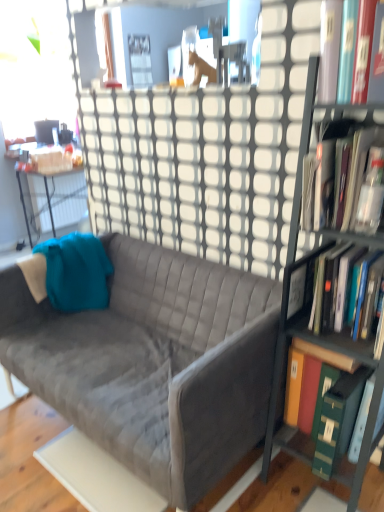
Question: Considering the relative positions of green hardcover book at right, which ranks as the first book in bottom-to-top order, and velvet gray couch at center in the image provided, is green hardcover book at right, which ranks as the first book in bottom-to-top order, behind velvet gray couch at center?

Choices:
 (A) no
 (B) yes

Answer: (B)

Question: Is green hardcover book at right, marked as the 4th book in a top-to-bottom arrangement, to the left of velvet gray couch at center from the viewer's perspective?

Choices:
 (A) no
 (B) yes

Answer: (A)

Question: From a real-world perspective, is green hardcover book at right, marked as the 4th book in a top-to-bottom arrangement, beneath velvet gray couch at center?

Choices:
 (A) no
 (B) yes

Answer: (A)

Question: Does green hardcover book at right, which ranks as the first book in bottom-to-top order, touch velvet gray couch at center?

Choices:
 (A) no
 (B) yes

Answer: (A)

Question: Does green hardcover book at right, which ranks as the first book in bottom-to-top order, have a smaller size compared to velvet gray couch at center?

Choices:
 (A) no
 (B) yes

Answer: (B)

Question: Is green hardcover book at right, which ranks as the first book in bottom-to-top order, taller than velvet gray couch at center?

Choices:
 (A) yes
 (B) no

Answer: (B)

Question: Is green hardcover book at right, which ranks as the first book in bottom-to-top order, shorter than metallic gray bookcase at right?

Choices:
 (A) no
 (B) yes

Answer: (B)

Question: Is the depth of green hardcover book at right, marked as the 4th book in a top-to-bottom arrangement, greater than that of metallic gray bookcase at right?

Choices:
 (A) yes
 (B) no

Answer: (A)

Question: Is green hardcover book at right, marked as the 4th book in a top-to-bottom arrangement, bigger than metallic gray bookcase at right?

Choices:
 (A) no
 (B) yes

Answer: (A)

Question: Is green hardcover book at right, marked as the 4th book in a top-to-bottom arrangement, positioned before metallic gray bookcase at right?

Choices:
 (A) no
 (B) yes

Answer: (A)

Question: Does green hardcover book at right, which ranks as the first book in bottom-to-top order, have a greater height compared to metallic gray bookcase at right?

Choices:
 (A) yes
 (B) no

Answer: (B)

Question: Is green hardcover book at right, marked as the 4th book in a top-to-bottom arrangement, to the left of metallic gray bookcase at right from the viewer's perspective?

Choices:
 (A) yes
 (B) no

Answer: (B)

Question: Is matte black desk at left looking in the opposite direction of hardcover book at upper right, which is the 4th book from bottom to top?

Choices:
 (A) no
 (B) yes

Answer: (A)